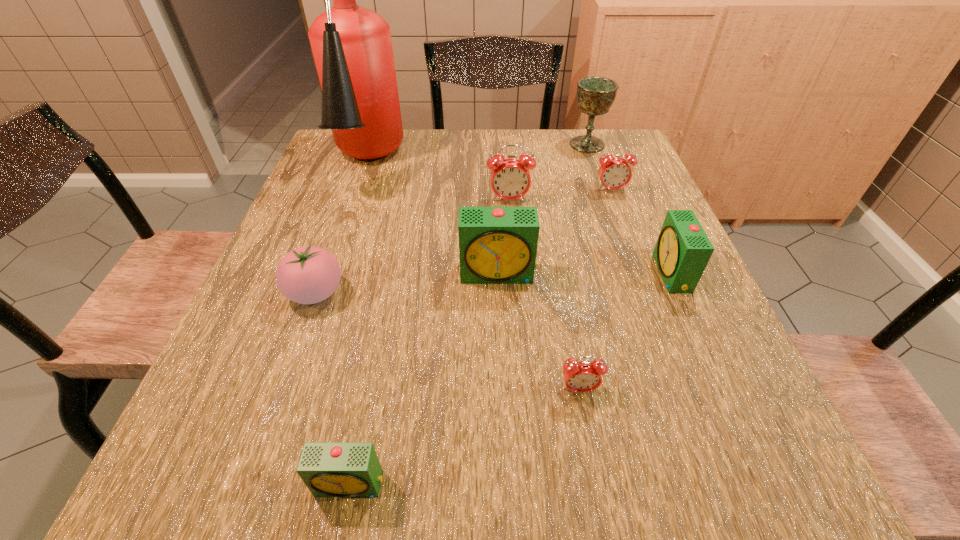
I want to click on the nearest red alarm clock, so click(x=584, y=376).

I want to click on the second nearest alarm clock, so click(x=584, y=376).

I want to click on the nearest alarm clock, so click(329, 469).

This screenshot has height=540, width=960. I want to click on the nearest object, so click(x=329, y=469).

Locate an element on the screen. This screenshot has height=540, width=960. vacant space situated with the nozzle aimed from the red fire extinguisher is located at coordinates (336, 252).

At what (x,y) coordinates should I click in order to perform the action: click on vacant region located on the front of the chalice. Please return your answer as a coordinate pair (x, y). Looking at the image, I should click on (598, 178).

Where is `vacant area located on the face of the biggest red alarm clock`? vacant area located on the face of the biggest red alarm clock is located at coordinates (519, 328).

Find the location of a particular element. This screenshot has height=540, width=960. vacant space located on the front-facing side of the biggest green alarm clock is located at coordinates (505, 449).

The width and height of the screenshot is (960, 540). I want to click on vacant area located 0.340m on the face of the rightmost red alarm clock, so click(x=650, y=296).

Locate an element on the screen. This screenshot has width=960, height=540. free point located 0.090m on the front-facing side of the rightmost green alarm clock is located at coordinates (614, 274).